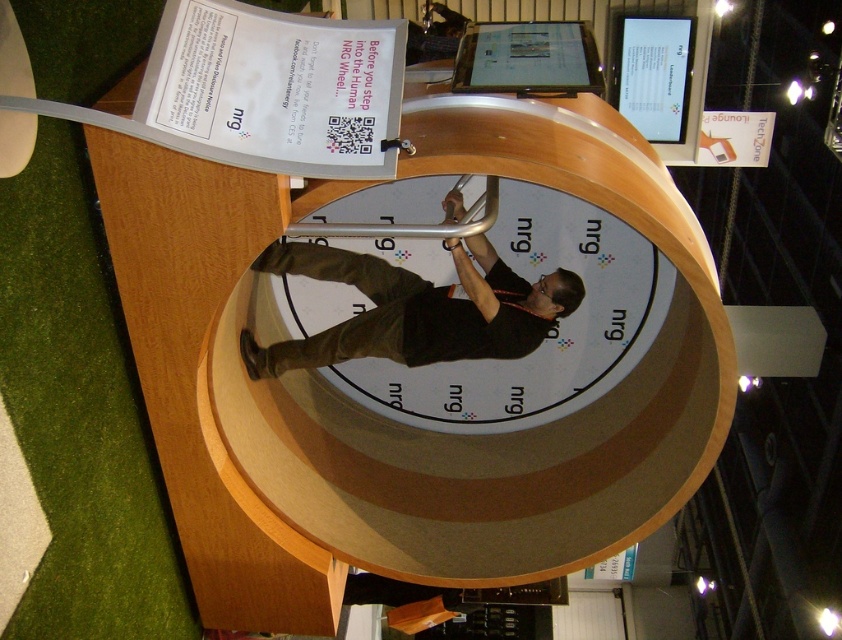
Question: Does dark brown leather pants at center have a larger size compared to matte black monitor at upper center?

Choices:
 (A) no
 (B) yes

Answer: (B)

Question: Is dark brown leather pants at center wider than matte black monitor at upper center?

Choices:
 (A) no
 (B) yes

Answer: (B)

Question: Can you confirm if dark brown leather pants at center is bigger than matte black monitor at upper center?

Choices:
 (A) no
 (B) yes

Answer: (B)

Question: Which object is farther from the camera taking this photo?

Choices:
 (A) matte black monitor at upper center
 (B) dark brown leather pants at center

Answer: (B)

Question: Which point is farther to the camera?

Choices:
 (A) (573, 288)
 (B) (464, 65)

Answer: (A)